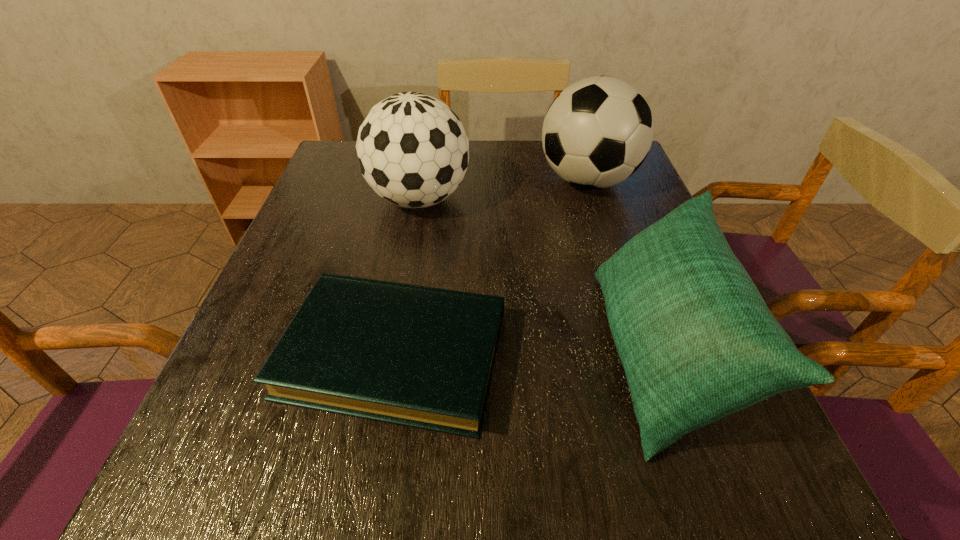
Locate an element on the screen. Image resolution: width=960 pixels, height=540 pixels. vacant area at the right edge of the desktop is located at coordinates (612, 226).

Where is `vacant space at the far left corner`? The width and height of the screenshot is (960, 540). vacant space at the far left corner is located at coordinates (323, 178).

This screenshot has width=960, height=540. In the image, there is a desktop. Identify the location of vacant space at the near left corner. tap(194, 454).

You are a GUI agent. You are given a task and a screenshot of the screen. Output one action in this format:
    pyautogui.click(x=<x>, y=<y>)
    Task: Click on the free spot at the near right corner of the desktop
    This screenshot has height=540, width=960.
    Given the screenshot: What is the action you would take?
    pyautogui.click(x=789, y=480)

Locate an element on the screen. free space between the right soccer ball and the left soccer ball is located at coordinates (503, 190).

You are a GUI agent. You are given a task and a screenshot of the screen. Output one action in this format:
    pyautogui.click(x=<x>, y=<y>)
    Task: Click on the free space between the left soccer ball and the right soccer ball
    This screenshot has height=540, width=960.
    Given the screenshot: What is the action you would take?
    click(503, 190)

Locate an element on the screen. The image size is (960, 540). vacant space that's between the book and the left soccer ball is located at coordinates (407, 277).

Locate an element on the screen. This screenshot has height=540, width=960. free space between the book and the right soccer ball is located at coordinates (491, 268).

This screenshot has width=960, height=540. I want to click on vacant point located between the shortest object and the left soccer ball, so click(407, 277).

Locate an element on the screen. vacant space that is in between the book and the left soccer ball is located at coordinates (407, 277).